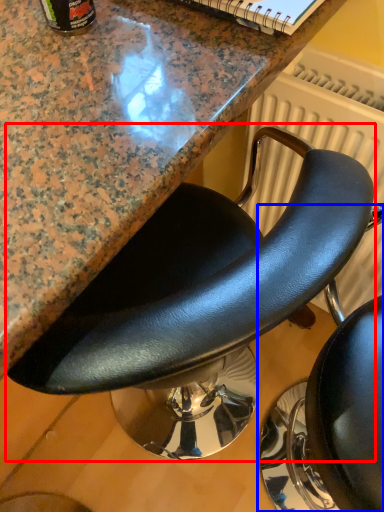
Question: Which point is further to the camera, chair (highlighted by a red box) or chair (highlighted by a blue box)?

Choices:
 (A) chair
 (B) chair

Answer: (A)